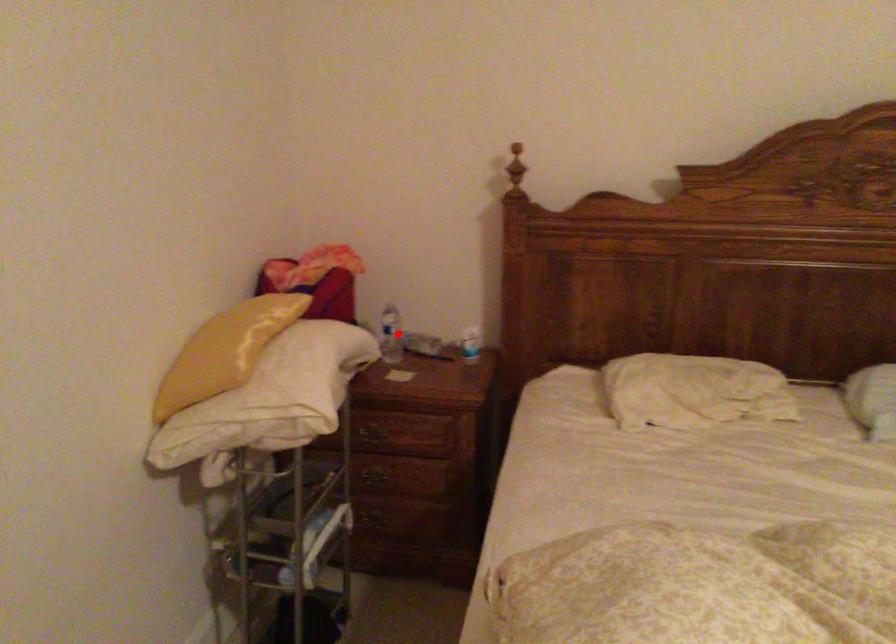
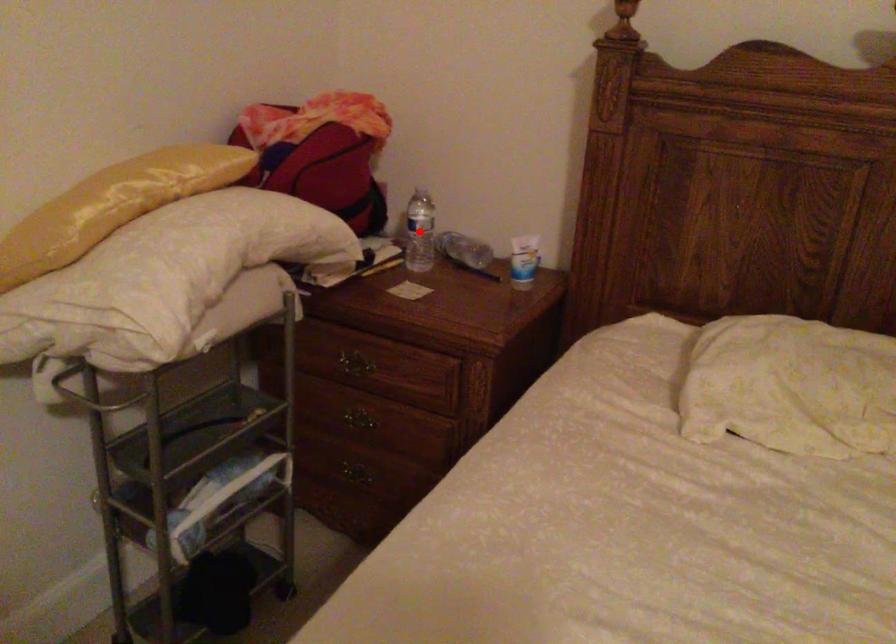
I am providing you with two images of the same scene from different viewpoints. A red point is marked on the first image and another point is marked on the second image. Is the marked point in image1 the same physical position as the marked point in image2?

Yes